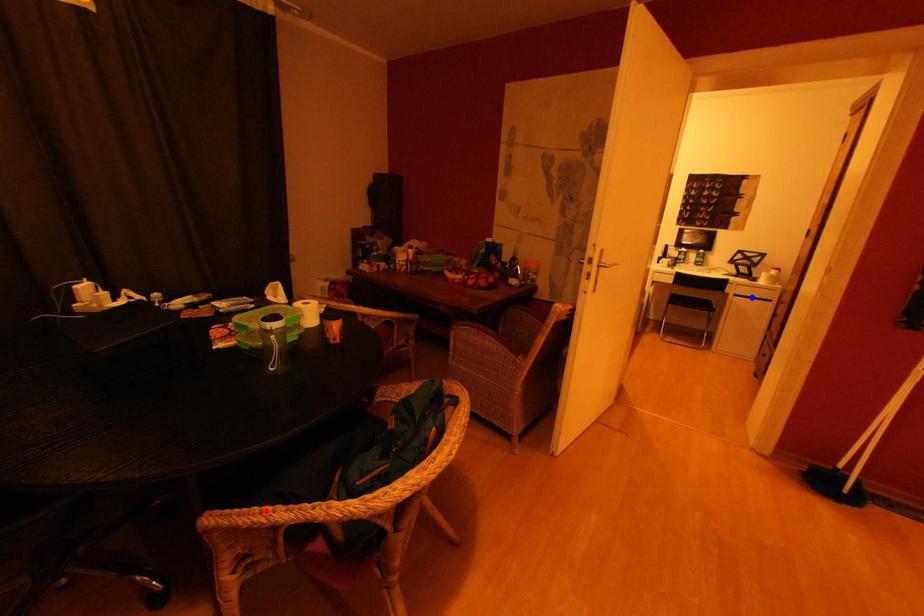
Question: In the image, two points are highlighted. Which point is nearer to the camera? Reply with the corresponding letter.

Choices:
 (A) blue point
 (B) red point

Answer: (B)